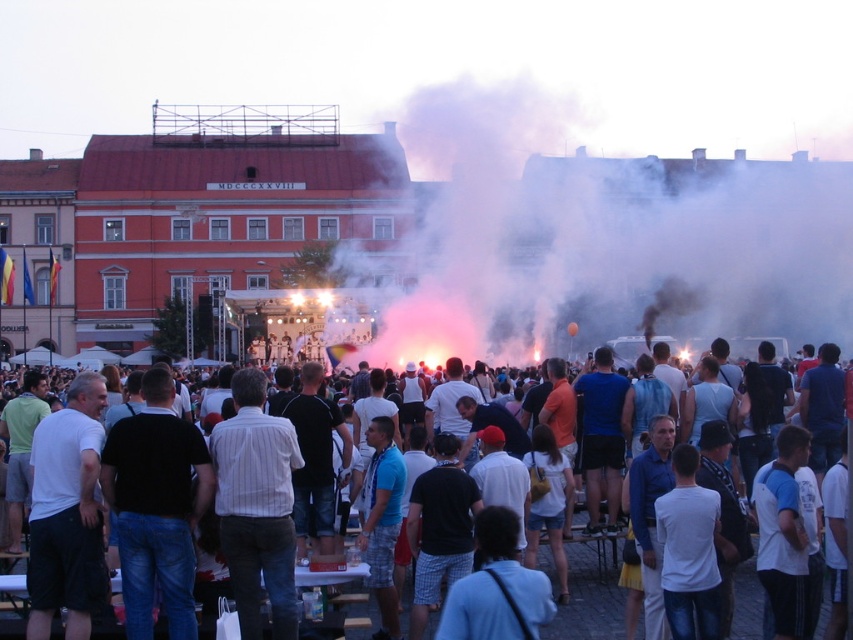
Question: Which point is farther to the camera?

Choices:
 (A) (664, 326)
 (B) (608, 548)

Answer: (A)

Question: Does pink smoke at center have a lesser width compared to white cotton crowd at center?

Choices:
 (A) yes
 (B) no

Answer: (B)

Question: Which point appears farthest from the camera in this image?

Choices:
 (A) (743, 570)
 (B) (769, 177)

Answer: (B)

Question: Which of the following is the closest to the observer?

Choices:
 (A) white cotton crowd at center
 (B) pink smoke at center

Answer: (A)

Question: Does pink smoke at center have a smaller size compared to white cotton crowd at center?

Choices:
 (A) yes
 (B) no

Answer: (B)

Question: Does pink smoke at center appear on the left side of white cotton crowd at center?

Choices:
 (A) no
 (B) yes

Answer: (A)